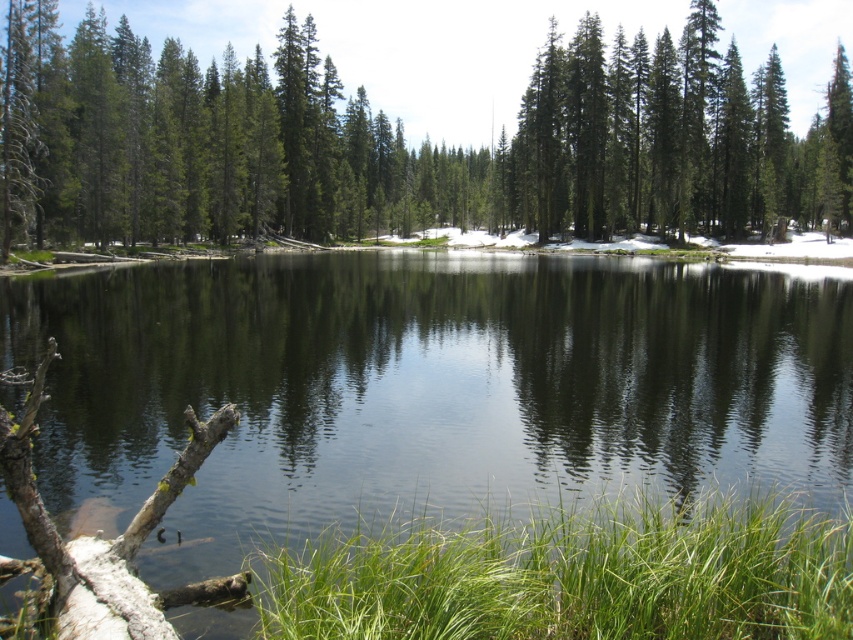
Looking at this image, does transparent water at center come in front of green matte tree at center?

Yes, transparent water at center is closer to the viewer.

Which is more to the left, transparent water at center or green matte tree at center?

Positioned to the left is transparent water at center.

Image resolution: width=853 pixels, height=640 pixels. I want to click on transparent water at center, so click(x=425, y=388).